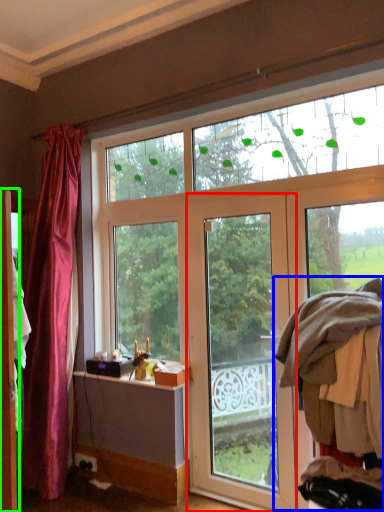
Question: Based on their relative distances, which object is nearer to door (highlighted by a red box)? Choose from laundry (highlighted by a blue box) and screen door (highlighted by a green box).

Choices:
 (A) laundry
 (B) screen door

Answer: (A)